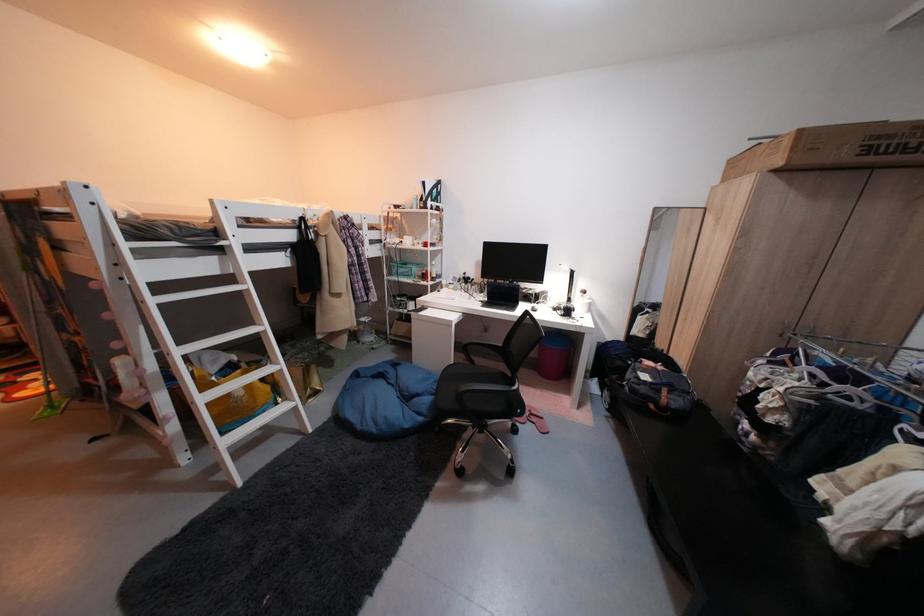
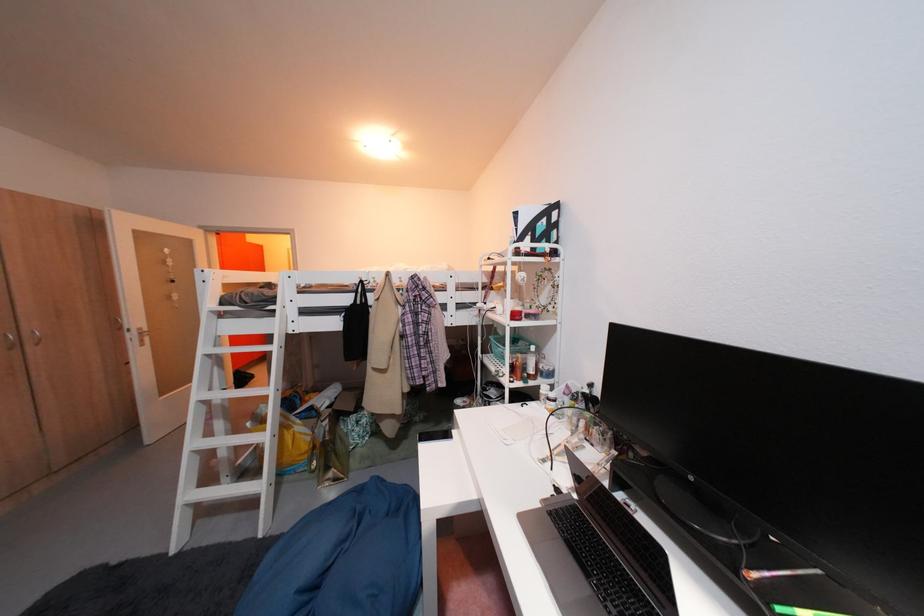
The point at (x=298, y=249) is marked in the first image. Where is the corresponding point in the second image?

(354, 314)